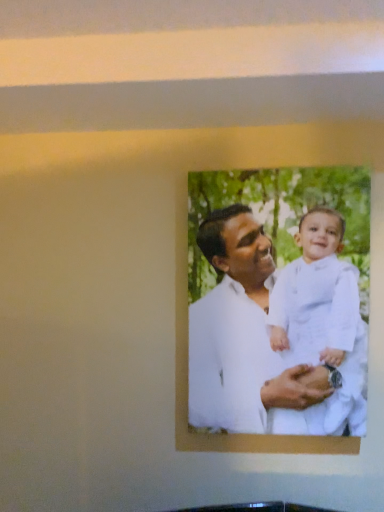
Describe the element at coordinates (254, 289) in the screenshot. I see `white cotton portrait at center` at that location.

Locate an element on the screen. This screenshot has width=384, height=512. white cotton portrait at center is located at coordinates (254, 289).

Find the location of `white cotton portrait at center`. white cotton portrait at center is located at coordinates (254, 289).